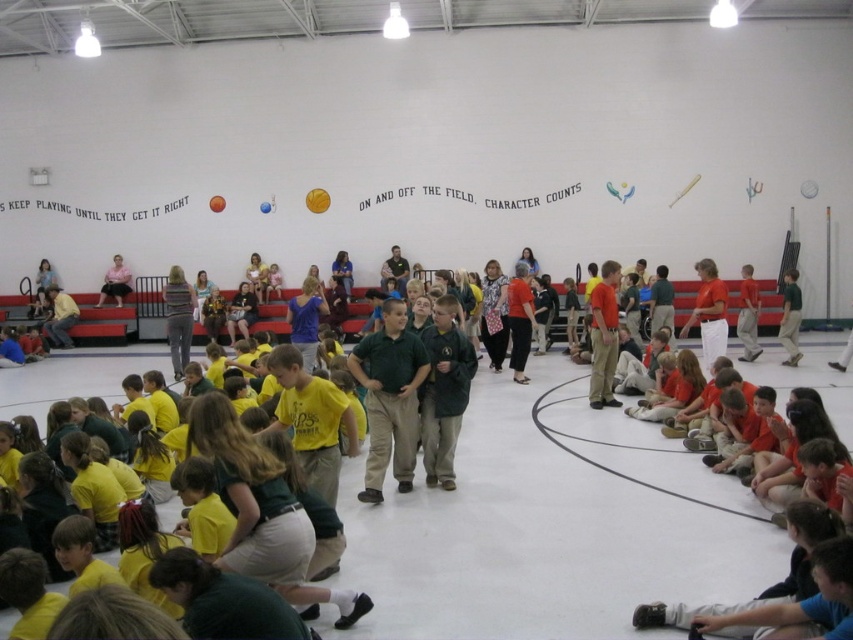
Can you confirm if pink fabric skirt at lower left is taller than yellow rubber balloon at upper center?

Correct, pink fabric skirt at lower left is much taller as yellow rubber balloon at upper center.

Is pink fabric skirt at lower left to the left of yellow rubber balloon at upper center from the viewer's perspective?

Correct, you'll find pink fabric skirt at lower left to the left of yellow rubber balloon at upper center.

Who is more forward, (100, 291) or (315, 189)?

Point (315, 189) is in front.

Locate an element on the screen. The width and height of the screenshot is (853, 640). pink fabric skirt at lower left is located at coordinates (115, 282).

Can you confirm if khaki pants at center is shorter than pink fabric skirt at lower left?

Incorrect, khaki pants at center's height does not fall short of pink fabric skirt at lower left's.

Is khaki pants at center smaller than pink fabric skirt at lower left?

No, khaki pants at center is not smaller than pink fabric skirt at lower left.

Who is more forward, (376, 388) or (109, 280)?

Point (376, 388)

Where is `khaki pants at center`? khaki pants at center is located at coordinates (389, 397).

Is the position of khaki pants at center more distant than that of rubber balloon at center?

No, khaki pants at center is closer to the viewer.

Locate an element on the screen. The image size is (853, 640). khaki pants at center is located at coordinates (389, 397).

Image resolution: width=853 pixels, height=640 pixels. What are the coordinates of `khaki pants at center` in the screenshot? It's located at (389, 397).